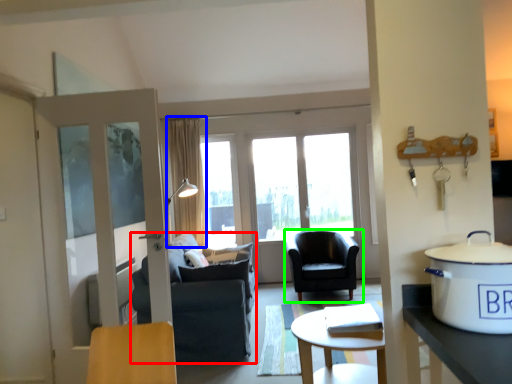
Question: Which object is positioned farthest from chair (highlighted by a red box)? Select from curtain (highlighted by a blue box) and chair (highlighted by a green box).

Choices:
 (A) curtain
 (B) chair

Answer: (A)